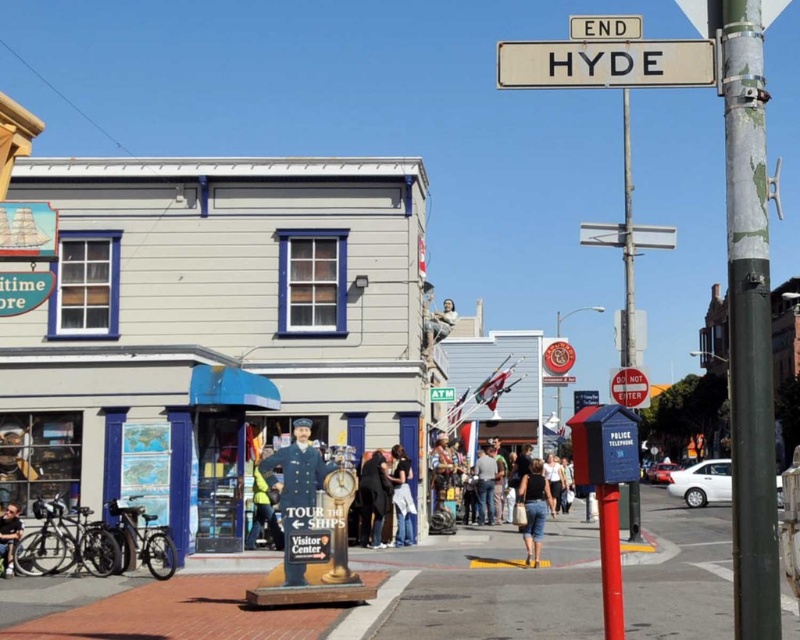
You are a delivery person trying to navigate the street. You see the white plastic street sign at upper center and the denim shorts at lower center. Which object is higher up in the image?

The white plastic street sign at upper center is taller than the denim shorts at lower center, so it is higher up in the image.

You are standing at the intersection of Hyde Street and need to determine which point is closer to you. You see two points labeled as point (628, 177) and point (492, 461). Which point is closer to your current position?

Point (492, 461) is closer to your current position because it is less further to the viewer than point (628, 177).